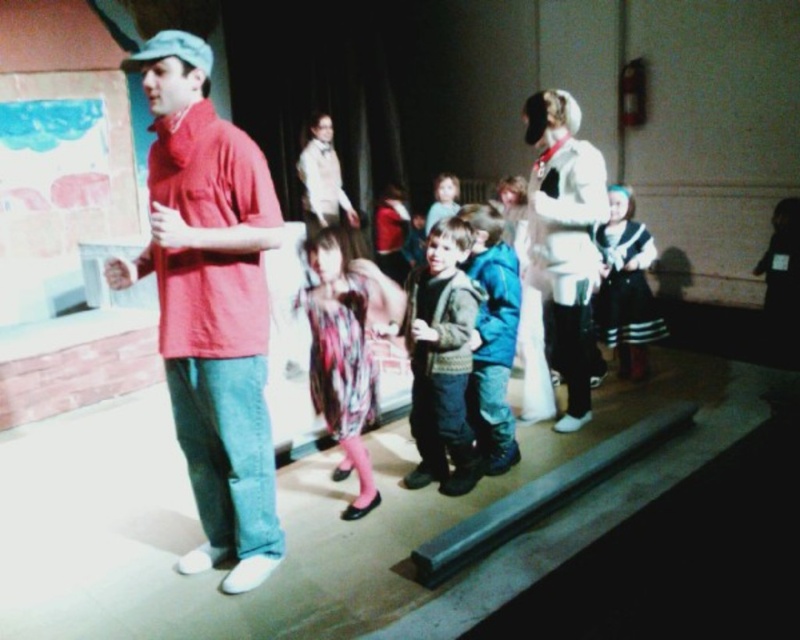
Question: Does matte red shirt at left have a greater width compared to blue fleece jacket at center?

Choices:
 (A) yes
 (B) no

Answer: (A)

Question: Estimate the real-world distances between objects in this image. Which object is closer to the matte red shirt at left?

Choices:
 (A) floral dress at center
 (B) white matte costume at center

Answer: (A)

Question: Which of the following is the farthest from the observer?

Choices:
 (A) (472, 460)
 (B) (436, 193)
 (C) (586, 246)

Answer: (B)

Question: Among these points, which one is farthest from the camera?

Choices:
 (A) (329, 298)
 (B) (440, 436)
 (C) (552, 90)
 (D) (160, 193)

Answer: (C)

Question: Does matte red shirt at left have a greater width compared to white matte costume at center?

Choices:
 (A) no
 (B) yes

Answer: (B)

Question: Does white matte costume at center have a lesser width compared to fluffy pink sweater at center?

Choices:
 (A) no
 (B) yes

Answer: (A)